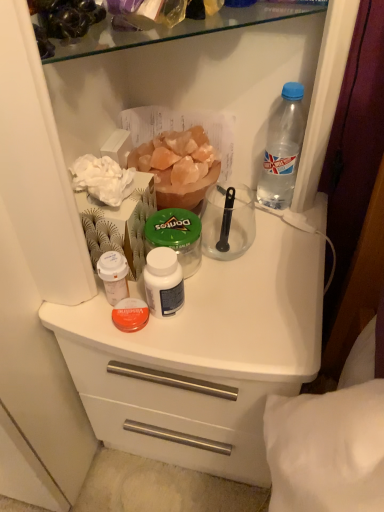
The width and height of the screenshot is (384, 512). What do you see at coordinates (228, 222) in the screenshot? I see `transparent plastic spoon at center` at bounding box center [228, 222].

From the picture: Measure the distance between transparent plastic bottle at upper right, placed as the first bottle when sorted from right to left, and camera.

The distance of transparent plastic bottle at upper right, placed as the first bottle when sorted from right to left, from camera is 25.29 inches.

At what (x,y) coordinates should I click in order to perform the action: click on green plastic jar at center. Please return your answer as a coordinate pair (x, y). The height and width of the screenshot is (512, 384). Looking at the image, I should click on (176, 236).

I want to click on transparent plastic spoon at center, so click(228, 222).

Find the location of a particular element. The height and width of the screenshot is (512, 384). bottle that is above the transparent plastic spoon at center (from the image's perspective) is located at coordinates (282, 149).

From the image's perspective, is transparent plastic bottle at upper right, the 2th bottle from the left, above or below transparent plastic spoon at center?

Clearly, from the image's perspective, transparent plastic bottle at upper right, the 2th bottle from the left, is above transparent plastic spoon at center.

Does transparent plastic bottle at upper right, placed as the first bottle when sorted from right to left, turn towards transparent plastic spoon at center?

No.

Measure the distance between transparent plastic bottle at upper right, the 2th bottle ordered from the bottom, and white matte jar at center.

transparent plastic bottle at upper right, the 2th bottle ordered from the bottom, and white matte jar at center are 12.03 inches apart from each other.

In the scene shown: From the image's perspective, is transparent plastic bottle at upper right, arranged as the 1th bottle when viewed from the top, on top of white matte jar at center?

Correct, transparent plastic bottle at upper right, arranged as the 1th bottle when viewed from the top, appears higher than white matte jar at center in the image.

Is transparent plastic bottle at upper right, the 2th bottle ordered from the bottom, inside or outside of white matte jar at center?

transparent plastic bottle at upper right, the 2th bottle ordered from the bottom, is not enclosed by white matte jar at center.

Considering the relative positions of white matte plastic cup at upper left, the 2th bottle when ordered from right to left, and white matte jar at center in the image provided, is white matte plastic cup at upper left, the 2th bottle when ordered from right to left, to the left or to the right of white matte jar at center?

white matte plastic cup at upper left, the 2th bottle when ordered from right to left, is positioned on white matte jar at center's left side.

Is white matte plastic cup at upper left, positioned as the 1th bottle in left-to-right order, in front of white matte jar at center?

No, it is behind white matte jar at center.

Is white matte plastic cup at upper left, marked as the second bottle in a top-to-bottom arrangement, taller than white matte jar at center?

In fact, white matte plastic cup at upper left, marked as the second bottle in a top-to-bottom arrangement, may be shorter than white matte jar at center.

From the image's perspective, which one is positioned higher, white matte plastic cup at upper left, positioned as the 1th bottle in left-to-right order, or white matte jar at center?

white matte plastic cup at upper left, positioned as the 1th bottle in left-to-right order, from the image's perspective.

Where is `bottle located on the right of green plastic jar at center`? The image size is (384, 512). bottle located on the right of green plastic jar at center is located at coordinates (282, 149).

Relative to transparent plastic bottle at upper right, the 2th bottle ordered from the bottom, is green plastic jar at center in front or behind?

Visually, green plastic jar at center is located in front of transparent plastic bottle at upper right, the 2th bottle ordered from the bottom.

Considering the sizes of objects green plastic jar at center and transparent plastic bottle at upper right, placed as the first bottle when sorted from right to left, in the image provided, who is thinner, green plastic jar at center or transparent plastic bottle at upper right, placed as the first bottle when sorted from right to left,?

With smaller width is transparent plastic bottle at upper right, placed as the first bottle when sorted from right to left.

Are green plastic jar at center and transparent plastic bottle at upper right, arranged as the 1th bottle when viewed from the top, beside each other?

No, green plastic jar at center is not with transparent plastic bottle at upper right, arranged as the 1th bottle when viewed from the top.

This screenshot has width=384, height=512. What are the coordinates of `bottle located below the transparent plastic spoon at center (from the image's perspective)` in the screenshot? It's located at (114, 276).

Does point (124, 293) lie behind point (218, 234)?

No, (124, 293) is in front of (218, 234).

Can we say white matte plastic cup at upper left, which is counted as the first bottle, starting from the bottom, lies outside transparent plastic spoon at center?

That's correct, white matte plastic cup at upper left, which is counted as the first bottle, starting from the bottom, is outside of transparent plastic spoon at center.

Is white matte plastic cup at upper left, the 2th bottle when ordered from right to left, facing towards transparent plastic spoon at center?

No, white matte plastic cup at upper left, the 2th bottle when ordered from right to left, is not turned towards transparent plastic spoon at center.

Is point (209, 238) positioned in front of point (149, 246)?

No.

From a real-world perspective, which is physically above, transparent plastic spoon at center or green plastic jar at center?

transparent plastic spoon at center is physically above.

From the image's perspective, is transparent plastic spoon at center on top of green plastic jar at center?

Correct, transparent plastic spoon at center appears higher than green plastic jar at center in the image.

Can white matte plastic counter at center be found inside transparent plastic spoon at center?

→ No, transparent plastic spoon at center does not contain white matte plastic counter at center.

Considering the points (216, 248) and (193, 295), which point is in front, point (216, 248) or point (193, 295)?

The point (193, 295) is closer to the camera.

Locate an element on the screen. The width and height of the screenshot is (384, 512). coffee cup above the white matte plastic counter at center (from a real-world perspective) is located at coordinates (228, 222).

You are a GUI agent. You are given a task and a screenshot of the screen. Output one action in this format:
    pyautogui.click(x=<x>, y=<y>)
    Task: Click on the coffee cup that is on the left side of transparent plastic bottle at upper right, placed as the first bottle when sorted from right to left
    The width and height of the screenshot is (384, 512).
    Given the screenshot: What is the action you would take?
    point(228,222)

Identify the location of bottle on the right of the white matte jar at center. This screenshot has width=384, height=512. (282, 149).

Looking at the image, which one is located closer to white matte plastic counter at center, green plastic jar at center or transparent plastic spoon at center?

Among the two, green plastic jar at center is located nearer to white matte plastic counter at center.

From the image, which object appears to be farther from green plastic jar at center, orange crystal salt at center or white matte plastic counter at center?

white matte plastic counter at center is further to green plastic jar at center.

Considering their positions, is green plastic jar at center positioned further to transparent plastic bottle at upper right, placed as the first bottle when sorted from right to left, than transparent plastic spoon at center?

green plastic jar at center is further to transparent plastic bottle at upper right, placed as the first bottle when sorted from right to left.

From the image, which object appears to be nearer to transparent plastic bottle at upper right, placed as the first bottle when sorted from right to left, transparent plastic spoon at center or white matte jar at center?

transparent plastic spoon at center is closer to transparent plastic bottle at upper right, placed as the first bottle when sorted from right to left.

Looking at the image, which one is located closer to white matte jar at center, white matte plastic cup at upper left, the 2th bottle when ordered from right to left, or green plastic jar at center?

white matte plastic cup at upper left, the 2th bottle when ordered from right to left, is positioned closer to the anchor white matte jar at center.

From the image, which object appears to be nearer to white matte plastic cup at upper left, the 2th bottle when ordered from right to left, orange crystal salt at center or green plastic jar at center?

The object closer to white matte plastic cup at upper left, the 2th bottle when ordered from right to left, is green plastic jar at center.

Estimate the real-world distances between objects in this image. Which object is further from white matte jar at center, white matte plastic counter at center or white matte plastic cup at upper left, which is counted as the first bottle, starting from the bottom?

Among the two, white matte plastic counter at center is located further to white matte jar at center.

Based on their spatial positions, is green plastic jar at center or transparent plastic bottle at upper right, the 2th bottle ordered from the bottom, closer to orange crystal salt at center?

green plastic jar at center lies closer to orange crystal salt at center than the other object.

Locate an element on the screen. The width and height of the screenshot is (384, 512). food between green plastic jar at center and transparent plastic bottle at upper right, the 2th bottle from the left is located at coordinates (178, 167).

In order to click on bottle between transparent plastic bottle at upper right, the 2th bottle ordered from the bottom, and white matte plastic counter at center from top to bottom in this screenshot , I will do `click(114, 276)`.

What are the coordinates of `yoghurt situated between white matte plastic cup at upper left, which is counted as the first bottle, starting from the bottom, and transparent plastic spoon at center from left to right` in the screenshot? It's located at (163, 282).

You are a GUI agent. You are given a task and a screenshot of the screen. Output one action in this format:
    pyautogui.click(x=<x>, y=<y>)
    Task: Click on the yoghurt between green plastic jar at center and white matte plastic counter at center in the vertical direction
    The image size is (384, 512).
    Given the screenshot: What is the action you would take?
    click(x=163, y=282)